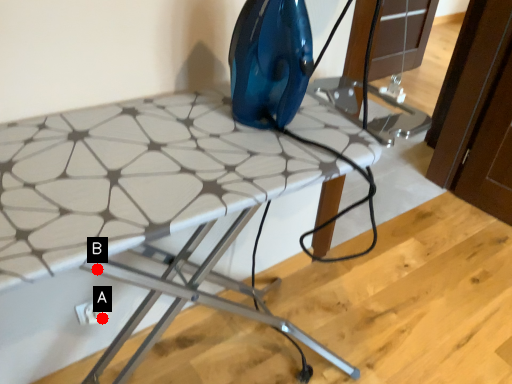
Question: Two points are circled on the image, labeled by A and B beside each circle. Among these points, which one is nearest to the camera?

Choices:
 (A) A is closer
 (B) B is closer

Answer: (B)